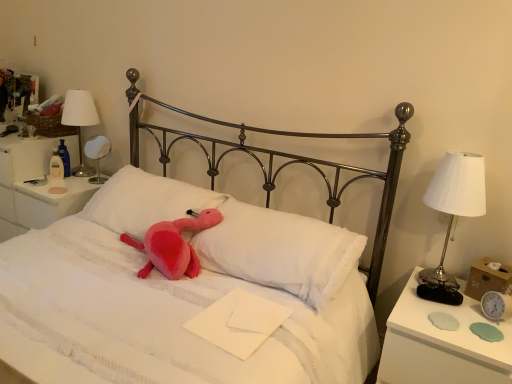
Find the location of a particular element. free space above white glossy nightstand at right, the 1th nightstand when ordered from front to back (from a real-world perspective) is located at coordinates (456, 319).